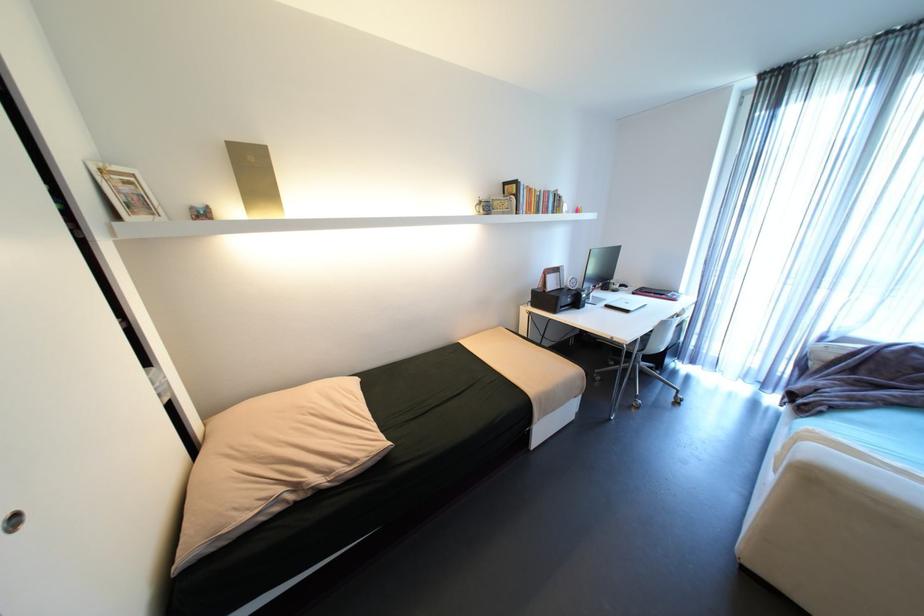
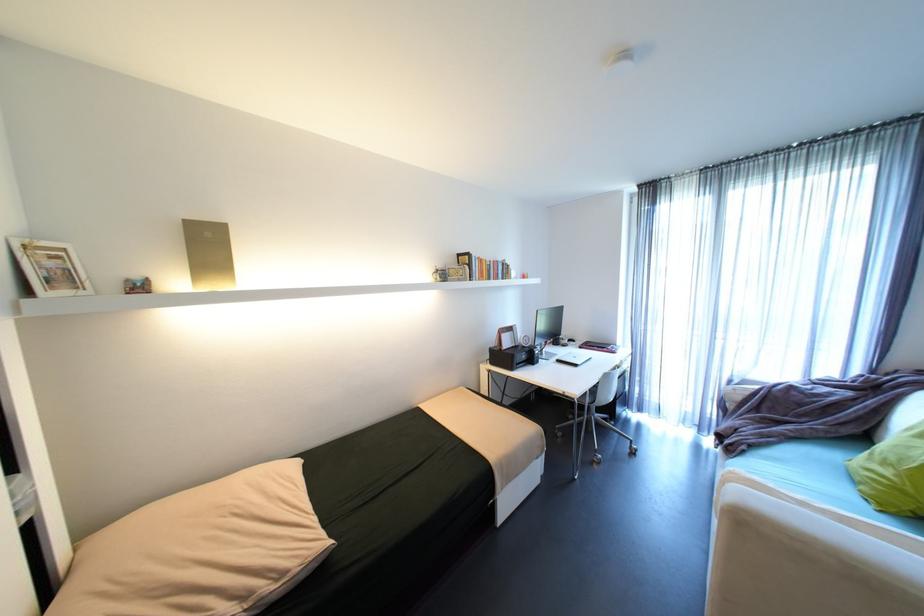
Locate, in the second image, the point that corresponds to the point at 671,294 in the first image.

(612, 347)